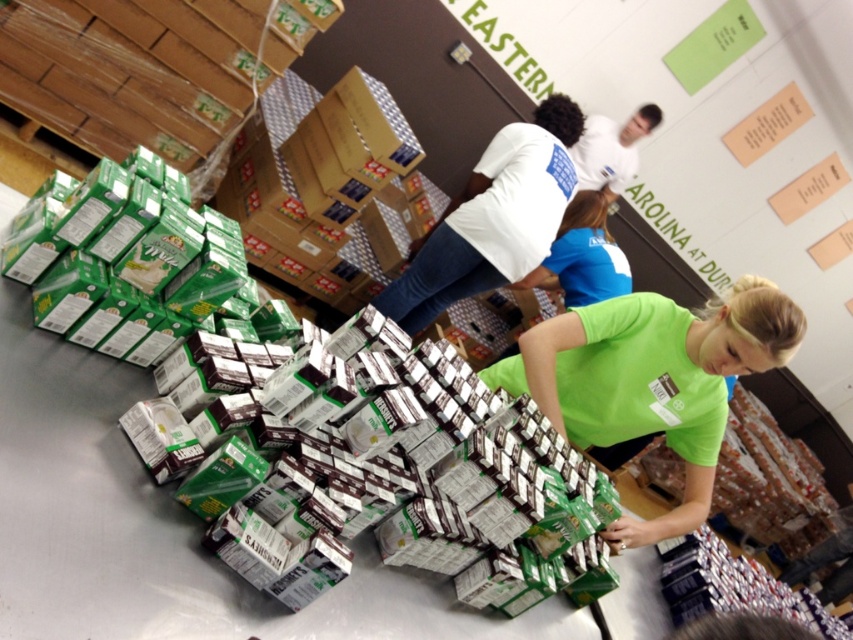
Does green matte shirt at center appear under white cotton shirt at center?

Indeed, green matte shirt at center is positioned under white cotton shirt at center.

Where is `green matte shirt at center`? The height and width of the screenshot is (640, 853). green matte shirt at center is located at coordinates (653, 380).